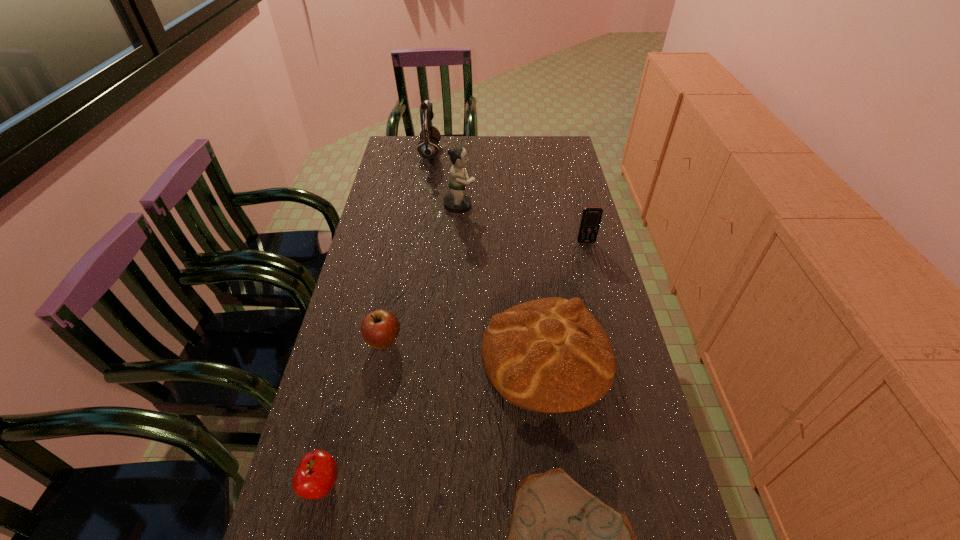
In the image, there is a desktop. Identify the location of vacant space at the right edge. The height and width of the screenshot is (540, 960). (623, 339).

Locate an element on the screen. vacant area at the far left corner is located at coordinates (404, 160).

Where is `free space at the far right corner of the desktop`? The height and width of the screenshot is (540, 960). free space at the far right corner of the desktop is located at coordinates pyautogui.click(x=570, y=156).

You are a GUI agent. You are given a task and a screenshot of the screen. Output one action in this format:
    pyautogui.click(x=<x>, y=<y>)
    Task: Click on the vacant area that lies between the bread and the third farthest object
    
    Given the screenshot: What is the action you would take?
    pyautogui.click(x=566, y=298)

Where is `vacant area that lies between the bread and the fourth object from right to left`? This screenshot has width=960, height=540. vacant area that lies between the bread and the fourth object from right to left is located at coordinates (503, 280).

Image resolution: width=960 pixels, height=540 pixels. What are the coordinates of `vacant space that's between the figurine and the bread` in the screenshot? It's located at (503, 280).

Locate an element on the screen. The height and width of the screenshot is (540, 960). object that stands as the closest to the cellular telephone is located at coordinates (551, 355).

Point out which object is positioned as the fourth nearest to the shorter apple. Please provide its 2D coordinates. Your answer should be formatted as a tuple, i.e. [(x, y)], where the tuple contains the x and y coordinates of a point satisfying the conditions above.

[(456, 202)]

You are a GUI agent. You are given a task and a screenshot of the screen. Output one action in this format:
    pyautogui.click(x=<x>, y=<y>)
    Task: Click on the vacant space that satisfies the following two spatial constraints: 1. on the front-facing side of the fourth object from right to left; 2. on the left side of the bread
    
    Given the screenshot: What is the action you would take?
    pyautogui.click(x=452, y=354)

I want to click on free spot that satisfies the following two spatial constraints: 1. on the front-facing side of the figurine; 2. on the right side of the bread, so click(x=452, y=354).